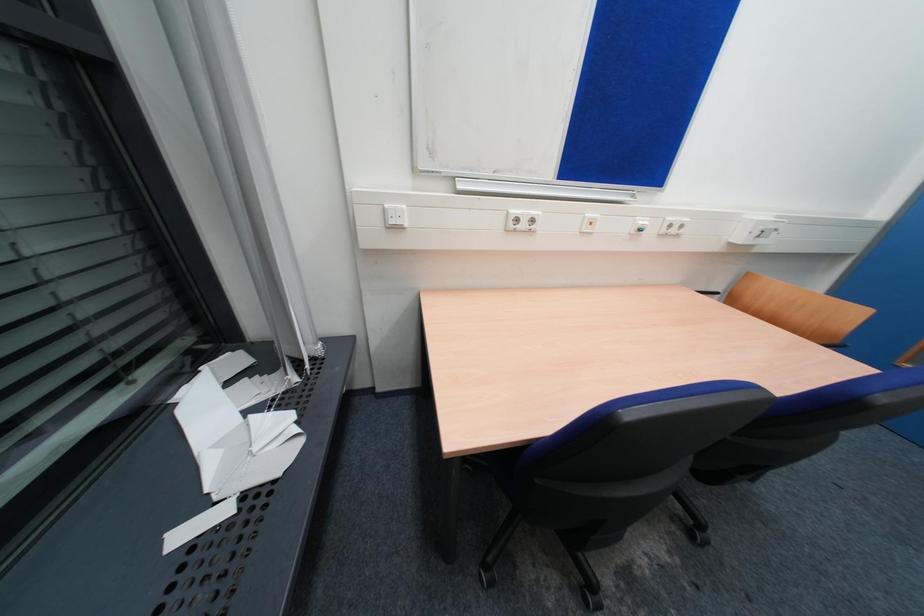
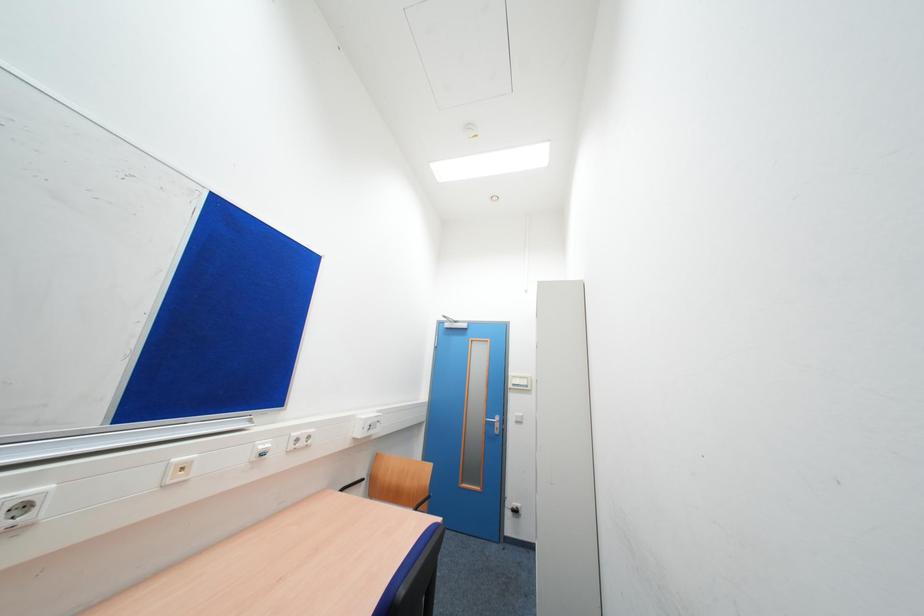
Based on the continuous images, in which direction is the camera rotating?

The camera rotated toward right-up.